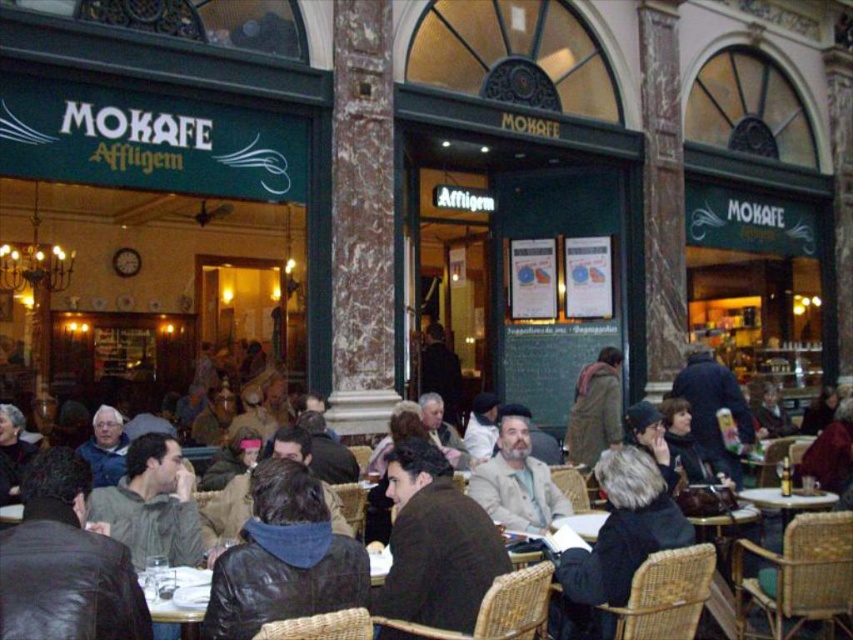
Which is behind, point (21, 556) or point (422, 580)?

Positioned behind is point (422, 580).

Who is lower down, leather jacket at lower left or brown leather jacket at center?

brown leather jacket at center is lower down.

Is point (68, 483) closer to viewer compared to point (422, 556)?

Yes, point (68, 483) is closer to viewer.

Find the location of a particular element. leather jacket at lower left is located at coordinates (65, 563).

Does dark brown leather jacket at center appear under brown wool coat at center?

Actually, dark brown leather jacket at center is above brown wool coat at center.

Which is above, dark brown leather jacket at center or brown wool coat at center?

dark brown leather jacket at center is above.

Does point (689, 374) come in front of point (602, 353)?

Yes.

Image resolution: width=853 pixels, height=640 pixels. I want to click on dark brown leather jacket at center, so click(x=704, y=384).

How far apart are leather jacket at lower left and dark brown leather jacket at center?

leather jacket at lower left and dark brown leather jacket at center are 23.56 meters apart from each other.

Which is behind, point (73, 474) or point (480, 484)?

The point (480, 484) is more distant.

Between point (44, 570) and point (653, 456), which one is positioned behind?

Positioned behind is point (653, 456).

The width and height of the screenshot is (853, 640). I want to click on leather jacket at lower left, so click(x=65, y=563).